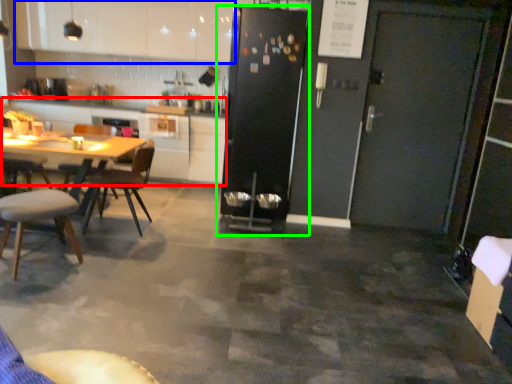
Question: Which is farther away from counter top (highlighted by a red box)? cabinetry (highlighted by a blue box) or refrigerator (highlighted by a green box)?

Choices:
 (A) cabinetry
 (B) refrigerator

Answer: (B)